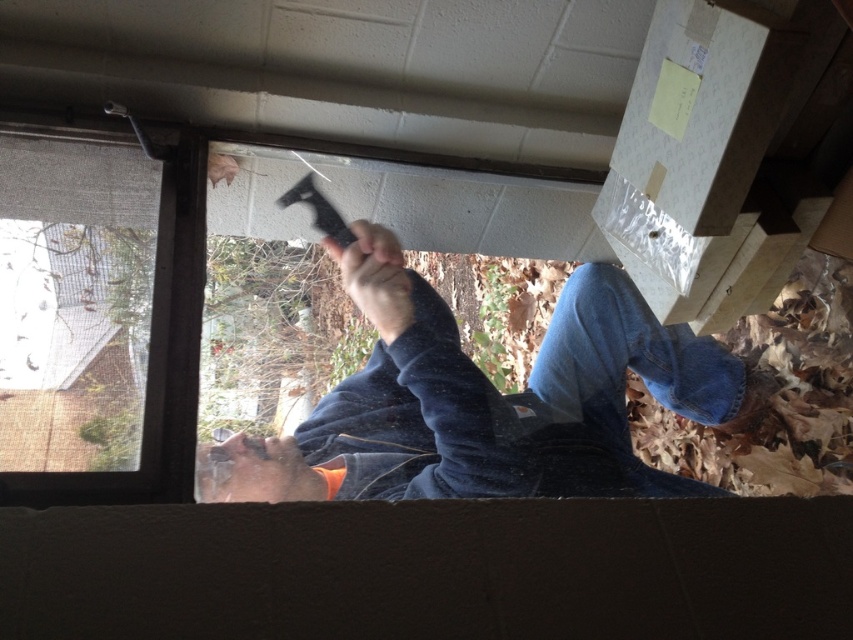
Based on the scene description, which object is taller between the dark blue fleece at center and the orange fabric hand at lower center?

The dark blue fleece at center is much taller than the orange fabric hand at lower center.

You are standing inside the building looking at the window. There are two points marked on the window frame. The first point is at coordinates point (196, 481) and the second point is at point (393, 296). Which point is closer to you?

Point (196, 481) is in front of point (393, 296), so it is closer to you.

You are a worker trying to reach the dark blue fleece at center with your orange fabric hand at lower center. Can you reach it without moving your hand?

The dark blue fleece at center is 11.31 inches away from the orange fabric hand at lower center. Since the distance is greater than typical human hand reach without moving, you cannot reach it without moving your hand.